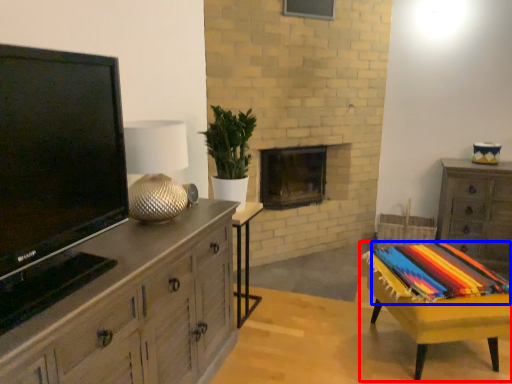
Question: Which point is closer to the camera, table (highlighted by a red box) or blanket (highlighted by a blue box)?

Choices:
 (A) table
 (B) blanket

Answer: (A)